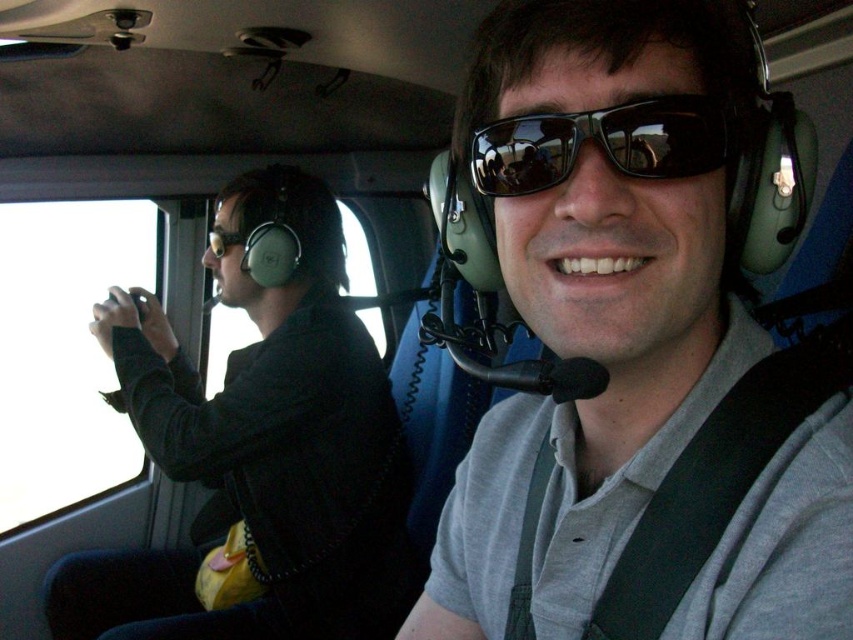
You are a passenger in the helicopter and want to know which object is taller between the black matte jacket at left and the black reflective sunglasses at center. Can you tell me?

The black matte jacket at left is taller than the black reflective sunglasses at center.

You are inside the helicopter and want to reach the black matte jacket at left. What is the approximate 2D coordinate of its location?

The black matte jacket at left is located at the 2D coordinate point of approximately 0.697 on the x axis and 0.305 on the y axis.